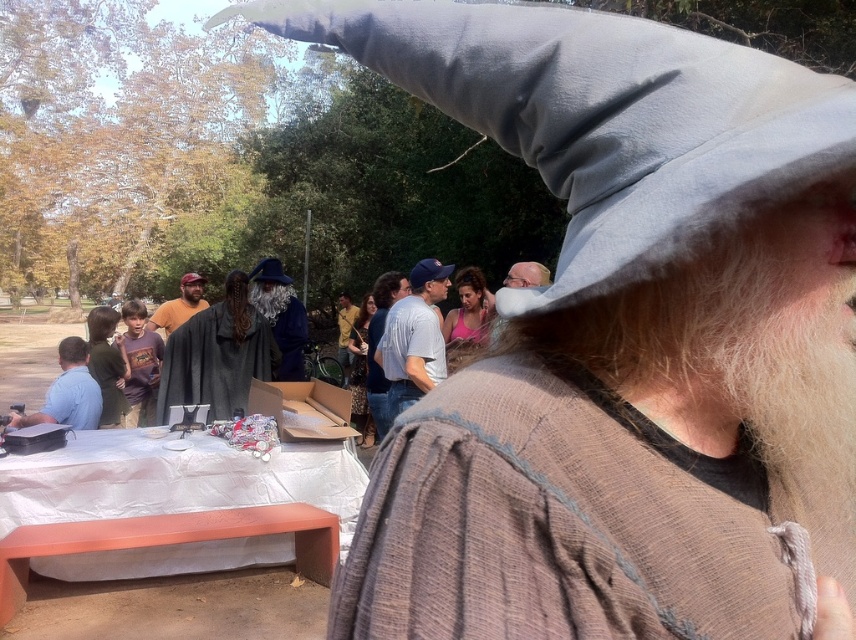
Question: Among these points, which one is nearest to the camera?

Choices:
 (A) (176, 326)
 (B) (97, 413)
 (C) (519, 282)

Answer: (C)

Question: Which of these objects is positioned closest to the matte brown shirt at center?

Choices:
 (A) velvet blue robe at center
 (B) white fluffy beard at upper center
 (C) orange painted wood picnic table at lower left
 (D) smooth gray beard at center

Answer: (A)

Question: Where is orange painted wood picnic table at lower left located in relation to light blue cotton shirt at left in the image?

Choices:
 (A) below
 (B) above

Answer: (A)

Question: Is velvet blue robe at center positioned behind light blue cotton shirt at left?

Choices:
 (A) yes
 (B) no

Answer: (A)

Question: Which point is closer to the camera taking this photo?

Choices:
 (A) (54, 388)
 (B) (266, 269)
 (C) (201, 321)
 (D) (355, 316)

Answer: (A)

Question: In this image, where is light blue denim jeans at center located relative to smooth gray beard at center?

Choices:
 (A) above
 (B) below

Answer: (B)